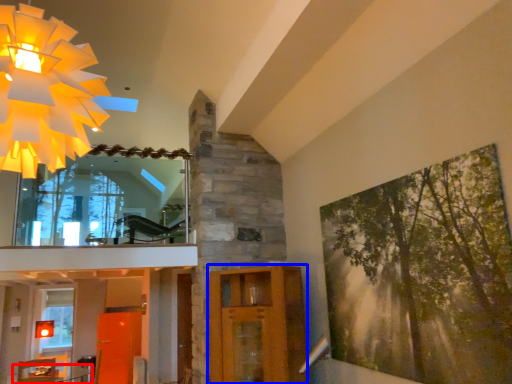
Question: Which point is closer to the camera, table (highlighted by a red box) or elevator (highlighted by a blue box)?

Choices:
 (A) table
 (B) elevator

Answer: (B)